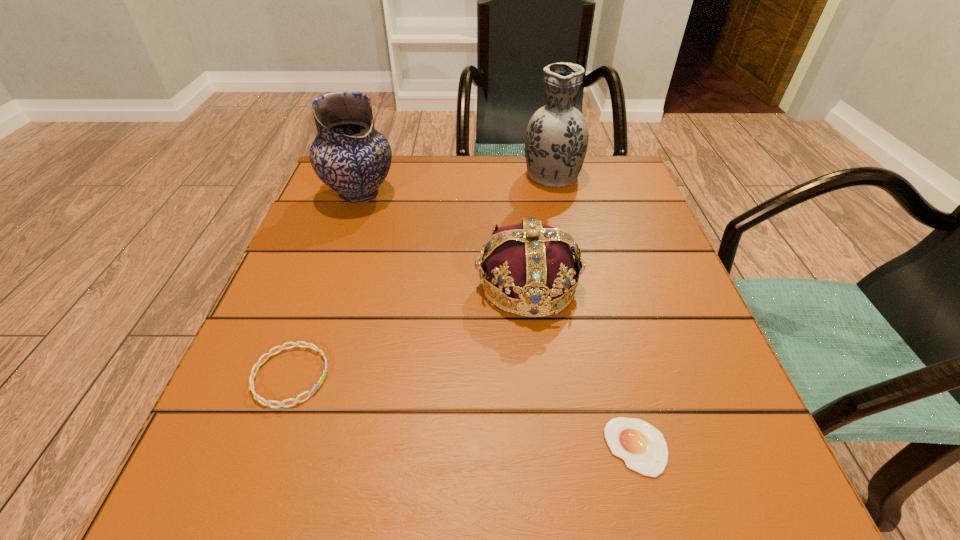
This screenshot has height=540, width=960. What are the coordinates of `vacant space located on the surface of the second shortest object showing star-shaped elements` in the screenshot? It's located at (x=426, y=376).

Find the location of a particular element. vacant region located on the right of the egg yolk is located at coordinates (705, 447).

Identify the location of vase that is at the far edge. This screenshot has width=960, height=540. pos(556,141).

The image size is (960, 540). What are the coordinates of `pottery positioned at the far edge` in the screenshot? It's located at (349, 155).

Where is `object that is at the near edge`? The height and width of the screenshot is (540, 960). object that is at the near edge is located at coordinates (643, 448).

This screenshot has width=960, height=540. In order to click on pottery that is at the left edge in this screenshot , I will do `click(349, 155)`.

This screenshot has width=960, height=540. I want to click on bracelet that is at the left edge, so click(x=309, y=345).

What are the coordinates of `vase situated at the right edge` in the screenshot? It's located at (556, 141).

The image size is (960, 540). What are the coordinates of `egg yolk located at the right edge` in the screenshot? It's located at (643, 448).

Find the location of a particular element. Image resolution: width=960 pixels, height=540 pixels. object that is at the far left corner is located at coordinates (349, 155).